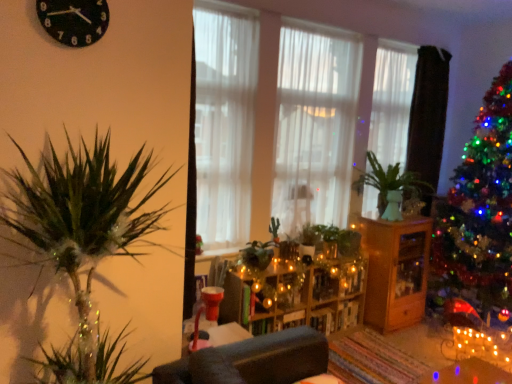
Identify the location of empty space that is ontop of white sheer curtain at center, which ranks as the third curtain in right-to-left order (from a real-world perspective). The width and height of the screenshot is (512, 384). (230, 5).